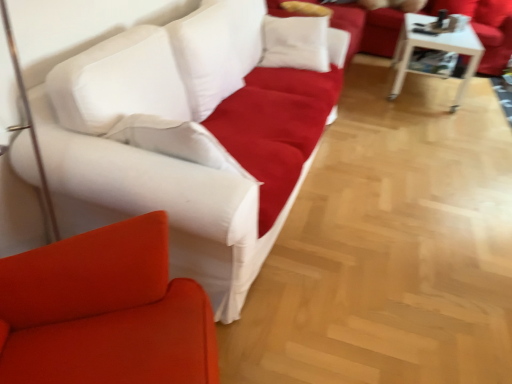
Question: Can you confirm if white glossy table at upper right is positioned to the left of white fabric couch at center, the 1th studio couch viewed from the left?

Choices:
 (A) no
 (B) yes

Answer: (A)

Question: From the image's perspective, would you say white glossy table at upper right is positioned over white fabric couch at center, arranged as the first studio couch when ordered from the bottom?

Choices:
 (A) yes
 (B) no

Answer: (A)

Question: Can you confirm if white glossy table at upper right is bigger than white fabric couch at center, which is counted as the 2th studio couch, starting from the back?

Choices:
 (A) yes
 (B) no

Answer: (B)

Question: From a real-world perspective, is white glossy table at upper right located beneath white fabric couch at center, which is the first studio couch from front to back?

Choices:
 (A) no
 (B) yes

Answer: (B)

Question: Considering the relative sizes of white glossy table at upper right and white fabric couch at center, the 1th studio couch viewed from the left, in the image provided, is white glossy table at upper right shorter than white fabric couch at center, the 1th studio couch viewed from the left,?

Choices:
 (A) no
 (B) yes

Answer: (B)

Question: Is white glossy table at upper right facing away from white fabric couch at center, which is the second studio couch in right-to-left order?

Choices:
 (A) no
 (B) yes

Answer: (A)

Question: Is white glossy table at upper right looking in the opposite direction of matte white studio couch at upper center, which is the first studio couch from top to bottom?

Choices:
 (A) no
 (B) yes

Answer: (B)

Question: Would you say white glossy table at upper right is a long distance from matte white studio couch at upper center, arranged as the 1th studio couch when viewed from the right?

Choices:
 (A) no
 (B) yes

Answer: (A)

Question: Considering the relative sizes of white glossy table at upper right and matte white studio couch at upper center, arranged as the 1th studio couch when viewed from the right, in the image provided, is white glossy table at upper right thinner than matte white studio couch at upper center, arranged as the 1th studio couch when viewed from the right,?

Choices:
 (A) no
 (B) yes

Answer: (B)

Question: Does white glossy table at upper right have a greater width compared to matte white studio couch at upper center, arranged as the 2th studio couch when viewed from the front?

Choices:
 (A) no
 (B) yes

Answer: (A)

Question: From a real-world perspective, is white glossy table at upper right physically above matte white studio couch at upper center, the 2th studio couch from the left?

Choices:
 (A) no
 (B) yes

Answer: (A)

Question: From the image's perspective, does white glossy table at upper right appear higher than matte white studio couch at upper center, which is the 2th studio couch in bottom-to-top order?

Choices:
 (A) no
 (B) yes

Answer: (A)

Question: Does matte white studio couch at upper center, positioned as the 1th studio couch in back-to-front order, have a greater width compared to white glossy table at upper right?

Choices:
 (A) yes
 (B) no

Answer: (A)